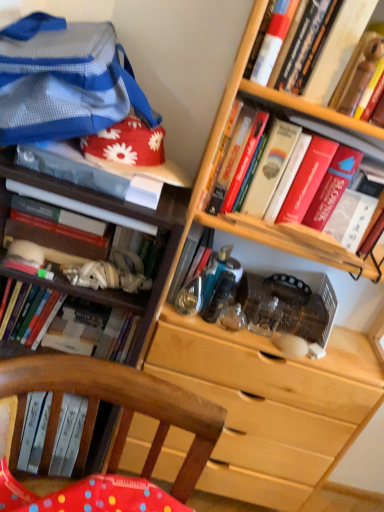
Question: Do you think hardcover book at upper right, which is the ninth book in left-to-right order, is within hardcover book at left, arranged as the 9th book when viewed from the right, or outside of it?

Choices:
 (A) inside
 (B) outside

Answer: (B)

Question: Looking at the image, does hardcover book at upper right, which is counted as the 1th book, starting from the right, seem bigger or smaller compared to hardcover book at left, arranged as the 9th book when viewed from the right?

Choices:
 (A) small
 (B) big

Answer: (A)

Question: Estimate the real-world distances between objects in this image. Which object is closer to the matte white book at upper left, acting as the 6th book starting from the right?

Choices:
 (A) hardcover book at left, which is the 3th book in left-to-right order
 (B) white matte book at upper right, positioned as the 4th book in right-to-left order
 (C) hardcover book at upper right, which is counted as the 1th book, starting from the right
 (D) hardcover book at left, the first book from the left
 (E) hardcover book at center-left, the 8th book in the right-to-left sequence

Answer: (A)

Question: Which is nearer to the hardcover book at left, which is the 3th book in left-to-right order?

Choices:
 (A) hardcover book at upper right, which is counted as the 1th book, starting from the right
 (B) blue striped fabric at upper left
 (C) hardcover book at upper right, which ranks as the 7th book in left-to-right order
 (D) matte white book at upper left, acting as the 6th book starting from the right
 (E) metallic blue book at center, which appears as the 5th book when viewed from the right

Answer: (D)